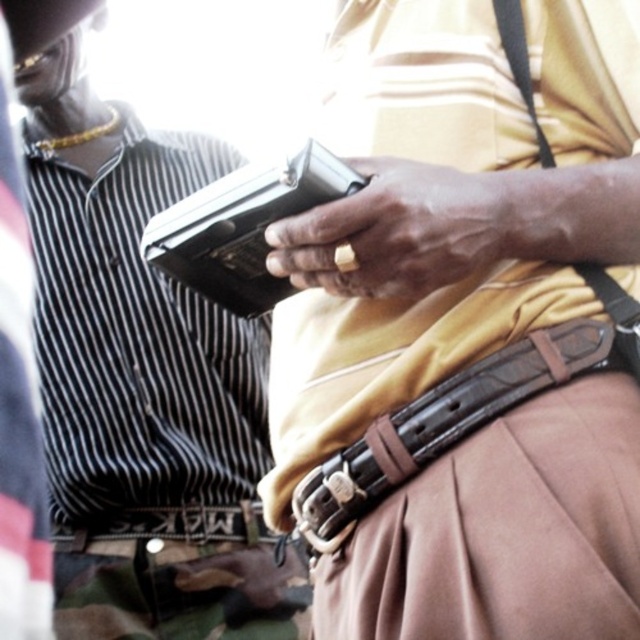
Question: Among these points, which one is nearest to the camera?

Choices:
 (A) (244, 220)
 (B) (273, 241)

Answer: (B)

Question: Does matte khaki pants at center have a smaller size compared to metallic gun at center?

Choices:
 (A) no
 (B) yes

Answer: (A)

Question: Can you confirm if matte black wallet at left is bigger than metallic gun at center?

Choices:
 (A) no
 (B) yes

Answer: (B)

Question: Which of the following is the closest to the observer?

Choices:
 (A) (435, 452)
 (B) (547, 348)
 (C) (225, 228)
 (D) (241, 582)

Answer: (B)

Question: Which of the following is the closest to the observer?

Choices:
 (A) (154, 224)
 (B) (88, 588)

Answer: (A)

Question: Is matte khaki pants at center positioned before matte black wallet at left?

Choices:
 (A) yes
 (B) no

Answer: (A)